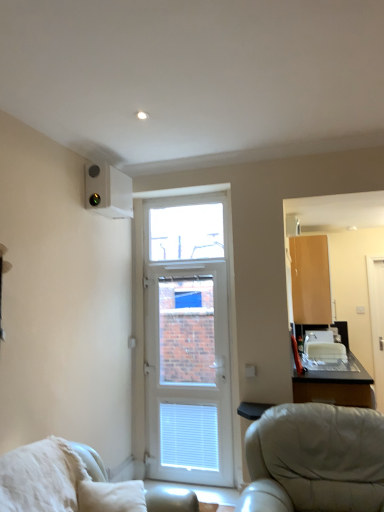
Question: Can you confirm if white plastic door at center is thinner than white glossy screen door at right?

Choices:
 (A) yes
 (B) no

Answer: (B)

Question: Is white plastic door at center placed right next to white glossy screen door at right?

Choices:
 (A) no
 (B) yes

Answer: (A)

Question: Is white glossy screen door at right located within white plastic door at center?

Choices:
 (A) no
 (B) yes

Answer: (A)

Question: Does white plastic door at center have a smaller size compared to white glossy screen door at right?

Choices:
 (A) no
 (B) yes

Answer: (A)

Question: Does white plastic door at center appear on the left side of white glossy screen door at right?

Choices:
 (A) yes
 (B) no

Answer: (A)

Question: From the image's perspective, is white plastic door at center positioned above or below white glossy screen door at right?

Choices:
 (A) below
 (B) above

Answer: (A)

Question: Is point (158, 262) positioned closer to the camera than point (372, 328)?

Choices:
 (A) closer
 (B) farther

Answer: (A)

Question: In terms of width, does white plastic door at center look wider or thinner when compared to white glossy screen door at right?

Choices:
 (A) thin
 (B) wide

Answer: (B)

Question: Considering the positions of white plastic door at center and white glossy screen door at right in the image, is white plastic door at center bigger or smaller than white glossy screen door at right?

Choices:
 (A) small
 (B) big

Answer: (B)

Question: From their relative heights in the image, would you say white plastic air conditioning unit at upper left is taller or shorter than white plastic door at center?

Choices:
 (A) tall
 (B) short

Answer: (B)

Question: Is white plastic air conditioning unit at upper left spatially inside white plastic door at center, or outside of it?

Choices:
 (A) inside
 (B) outside

Answer: (B)

Question: From a real-world perspective, is white plastic air conditioning unit at upper left positioned above or below white plastic door at center?

Choices:
 (A) above
 (B) below

Answer: (A)

Question: Considering the positions of point (122, 173) and point (140, 332), is point (122, 173) closer or farther from the camera than point (140, 332)?

Choices:
 (A) farther
 (B) closer

Answer: (B)

Question: From the image's perspective, relative to white fluffy pillow at lower left, is white plastic door at center above or below?

Choices:
 (A) above
 (B) below

Answer: (A)

Question: From a real-world perspective, is white plastic door at center positioned above or below white fluffy pillow at lower left?

Choices:
 (A) above
 (B) below

Answer: (A)